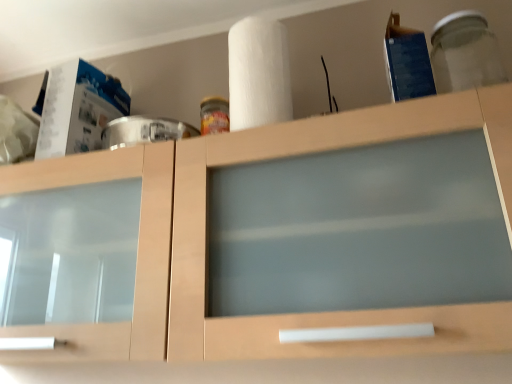
Question: From a real-world perspective, is transparent glass jar at upper right physically located above or below matte wood cabinet at center?

Choices:
 (A) above
 (B) below

Answer: (A)

Question: Is transparent glass jar at upper right in front of or behind matte wood cabinet at center in the image?

Choices:
 (A) front
 (B) behind

Answer: (B)

Question: Based on their relative distances, which object is nearer to the transparent glass jar at upper right?

Choices:
 (A) white matte paper towel at upper center
 (B) matte wood cabinet at center

Answer: (A)

Question: Which of these objects is positioned closest to the transparent glass jar at upper right?

Choices:
 (A) white matte paper towel at upper center
 (B) matte wood cabinet at center

Answer: (A)